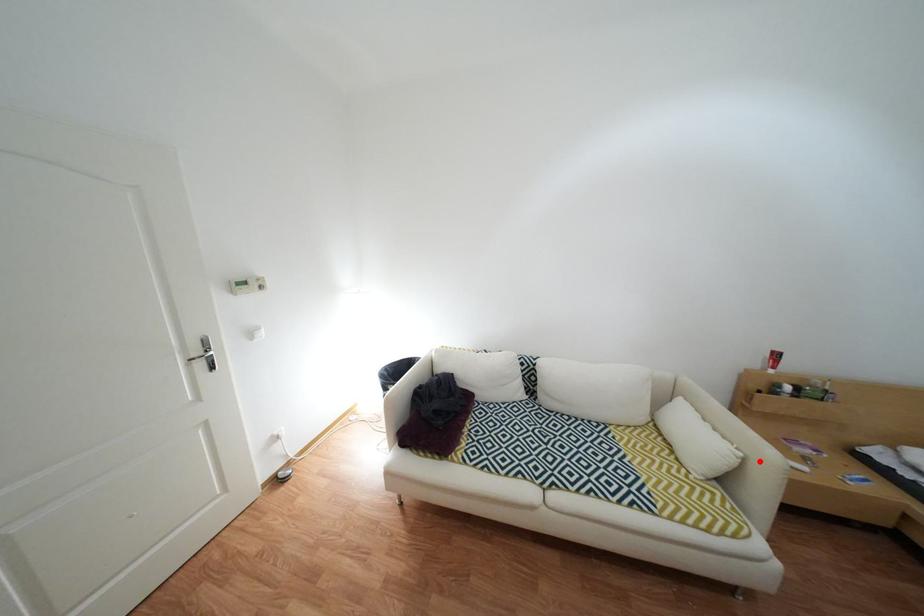
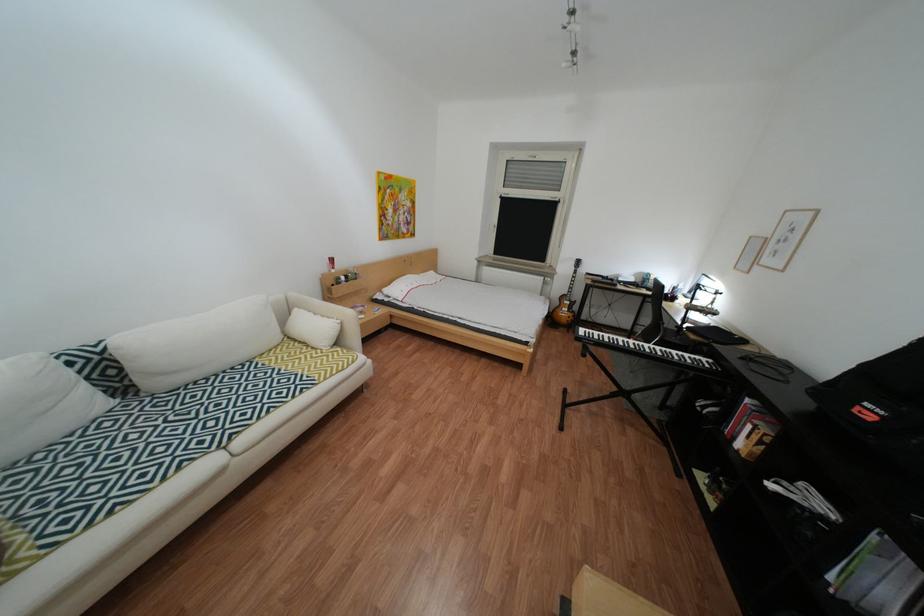
In the second image, find the point that corresponds to the highlighted location in the first image.

(358, 323)